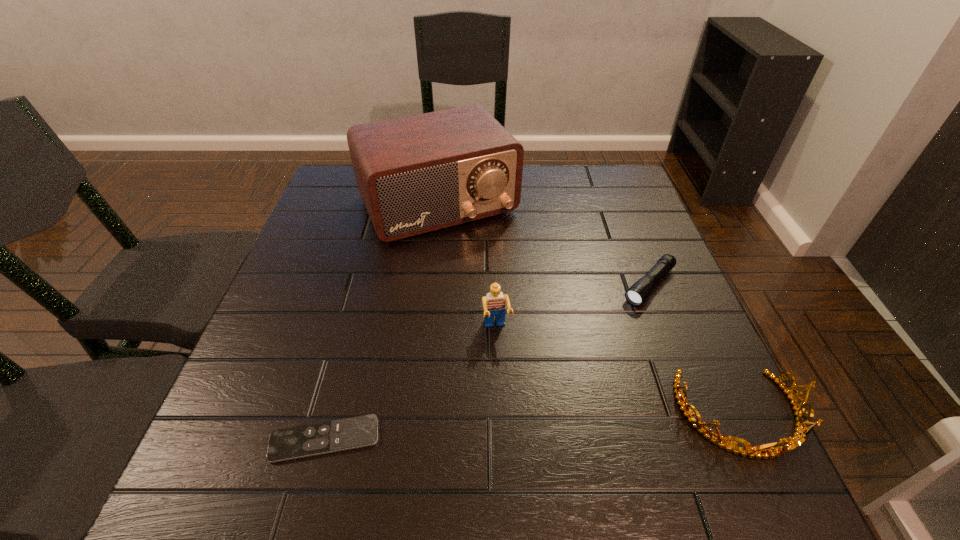
Image resolution: width=960 pixels, height=540 pixels. What are the coordinates of `tiara at the right edge` in the screenshot? It's located at (799, 437).

Find the location of `flashlight that is at the right edge`. flashlight that is at the right edge is located at coordinates (641, 289).

Identify the location of object positioned at the far left corner. click(x=416, y=174).

The image size is (960, 540). In order to click on object at the near left corner in this screenshot , I will do point(285,444).

Locate an element on the screen. The width and height of the screenshot is (960, 540). object at the near right corner is located at coordinates (799, 437).

The height and width of the screenshot is (540, 960). In the image, there is a desktop. Find the location of `vacant space at the far edge`. vacant space at the far edge is located at coordinates (539, 202).

Where is `vacant point at the near edge`? This screenshot has height=540, width=960. vacant point at the near edge is located at coordinates (535, 400).

You are a GUI agent. You are given a task and a screenshot of the screen. Output one action in this format:
    pyautogui.click(x=<x>, y=<y>)
    Task: Click on the vacant area at the left edge
    The width and height of the screenshot is (960, 540).
    Given the screenshot: What is the action you would take?
    pyautogui.click(x=305, y=289)

Find the location of a particular element. The image size is (960, 540). blank space at the right edge of the desktop is located at coordinates (628, 288).

Where is `vacant space at the far right corner of the desktop`? Image resolution: width=960 pixels, height=540 pixels. vacant space at the far right corner of the desktop is located at coordinates (612, 202).